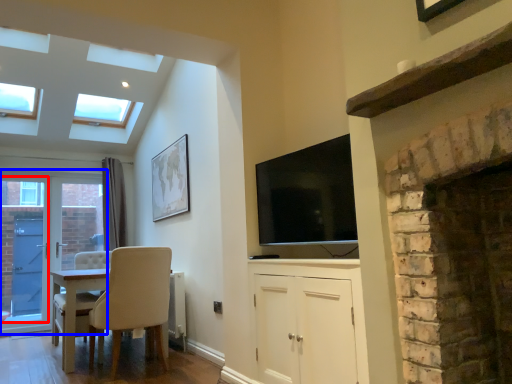
Question: Which object is further to the camera taking this photo, glass door (highlighted by a red box) or door (highlighted by a blue box)?

Choices:
 (A) glass door
 (B) door

Answer: (B)